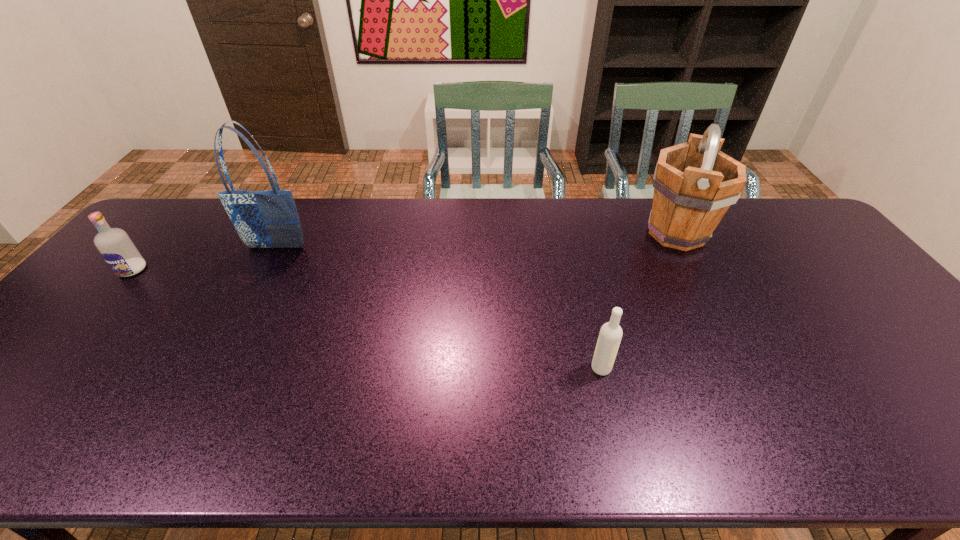
Where is `shopping bag`? shopping bag is located at coordinates (263, 219).

Identify the location of the rightmost object. (694, 184).

Find the location of `the third object from left to right`. the third object from left to right is located at coordinates [x=610, y=335].

Locate an element on the screen. This screenshot has height=540, width=960. the nearer vodka is located at coordinates (610, 335).

At what (x,y) coordinates should I click in order to perform the action: click on the second nearest object. Please return your answer as a coordinate pair (x, y). The width and height of the screenshot is (960, 540). Looking at the image, I should click on (115, 246).

Identify the location of the leftmost object. The image size is (960, 540). (115, 246).

The image size is (960, 540). In order to click on vacant space located on the front-facing side of the second object from left to right in this screenshot , I will do `click(262, 274)`.

Find the location of a particular element. free spot located on the left of the bucket is located at coordinates (554, 233).

Identify the location of vacant space situated 0.100m on the back of the third object from left to right. The image size is (960, 540). (591, 328).

At what (x,y) coordinates should I click in order to perform the action: click on free space located 0.190m on the label of the leftmost object. Please return your answer as a coordinate pair (x, y). This screenshot has height=540, width=960. Looking at the image, I should click on (81, 329).